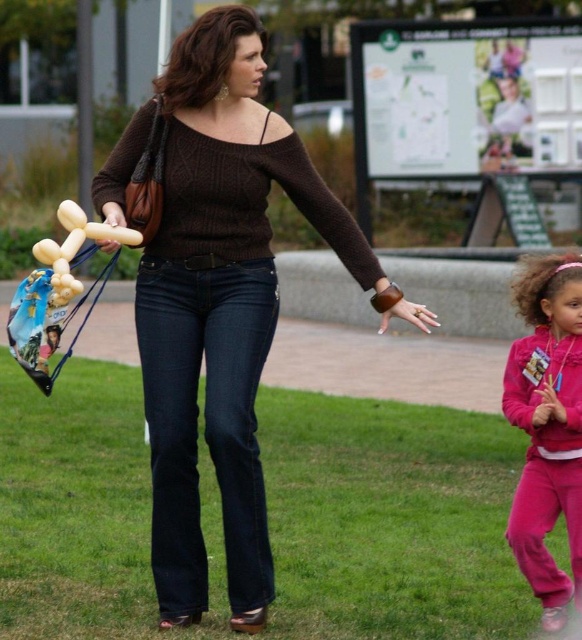
Question: Which of the following is the farthest from the observer?

Choices:
 (A) golden balloon animal at left
 (B) green grass at lower center

Answer: (B)

Question: Considering the real-world distances, which object is farthest from the pink fleece pants at right?

Choices:
 (A) translucent yellow balloon animal at left
 (B) brown knit sweater at center
 (C) golden balloon animal at left

Answer: (C)

Question: Can you confirm if green grass at lower center is positioned below brown knit sweater at center?

Choices:
 (A) yes
 (B) no

Answer: (A)

Question: Which point is closer to the camera taking this photo?

Choices:
 (A) (72, 339)
 (B) (69, 237)

Answer: (B)

Question: Is green grass at lower center to the left of pink fleece pants at right from the viewer's perspective?

Choices:
 (A) no
 (B) yes

Answer: (B)

Question: Is green grass at lower center behind brown knit sweater at center?

Choices:
 (A) yes
 (B) no

Answer: (A)